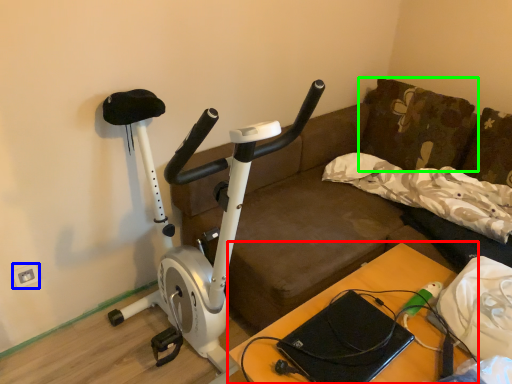
Question: Based on their relative distances, which object is nearer to table (highlighted by a red box)? Choose from electric outlet (highlighted by a blue box) and pillow (highlighted by a green box).

Choices:
 (A) electric outlet
 (B) pillow

Answer: (B)